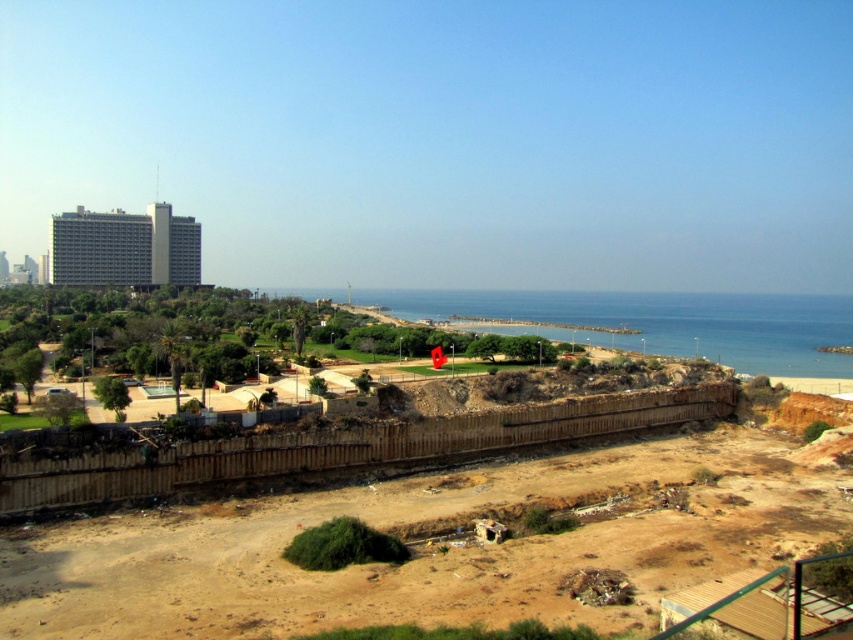
In the scene shown: Based on the scene description, which object takes up more space in the image, the blue water at center or the gray concrete building at upper left?

The blue water at center takes up more space in the image as it is described as bigger than the gray concrete building at upper left.

You are standing at the edge of the barren area near the wooden retaining wall. You want to walk to the blue water at center. Which direction should you head towards?

You should head towards the center of the image to reach the blue water at center, as it is located at point coordinates of [666,323].